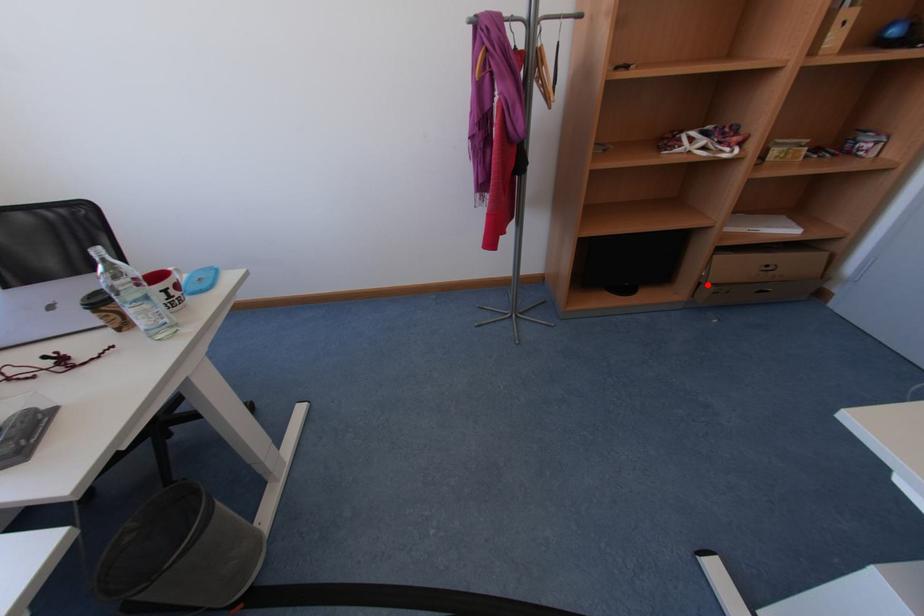
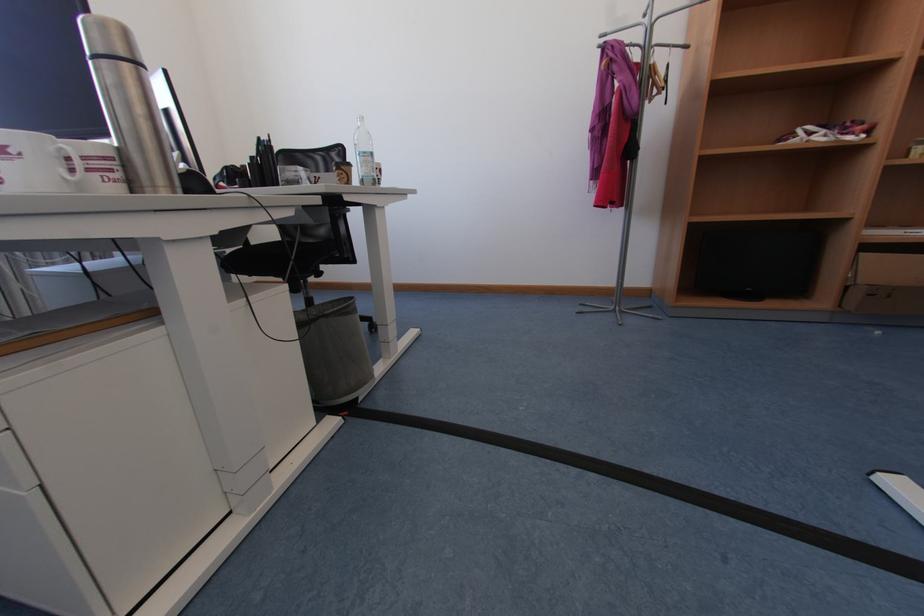
Question: I am providing you with two images of the same scene from different viewpoints. Given a red point in image1, look at the same physical point in image2. Is it:

Choices:
 (A) Closer to the viewpoint
 (B) Farther from the viewpoint

Answer: (B)